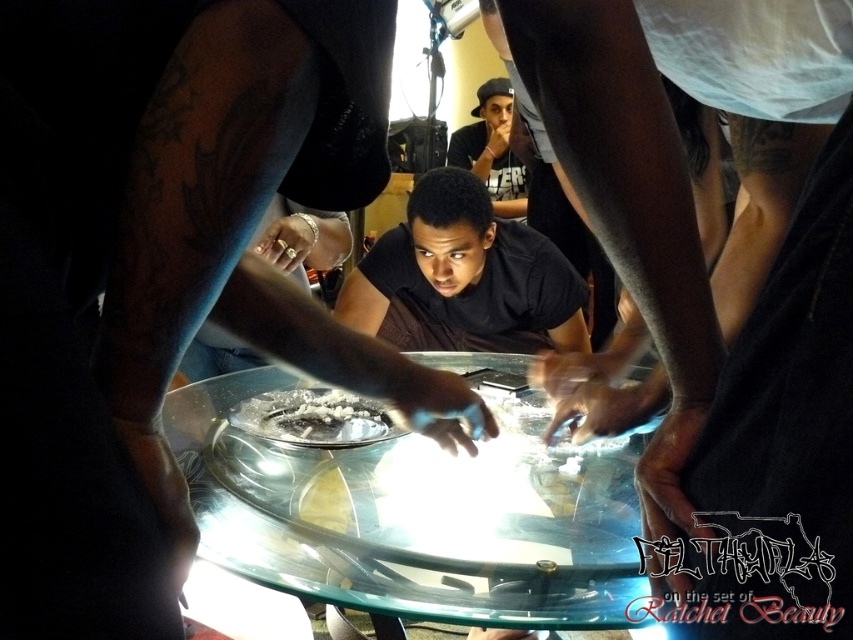
Can you confirm if white powder at center is positioned to the left of matte black shirt at upper center?

Correct, you'll find white powder at center to the left of matte black shirt at upper center.

Does white powder at center have a larger size compared to matte black shirt at upper center?

No.

Does point (334, 410) come farther from viewer compared to point (523, 173)?

No, it is not.

At what (x,y) coordinates should I click in order to perform the action: click on white powder at center. Please return your answer as a coordinate pair (x, y). The height and width of the screenshot is (640, 853). Looking at the image, I should click on (312, 417).

What do you see at coordinates (416, 515) in the screenshot? The width and height of the screenshot is (853, 640). I see `transparent glass table at center` at bounding box center [416, 515].

Is transparent glass table at center taller than black matte shirt at center?

In fact, transparent glass table at center may be shorter than black matte shirt at center.

Is point (408, 605) behind point (430, 208)?

That is False.

Identify the location of transparent glass table at center. (416, 515).

Is point (380, 512) farther from viewer compared to point (515, 214)?

No, it is not.

Between transparent glass table at center and matte black shirt at upper center, which one is positioned higher?

matte black shirt at upper center

Measure the distance between transparent glass table at center and camera.

They are 66.13 centimeters apart.

Locate an element on the screen. The image size is (853, 640). transparent glass table at center is located at coordinates (416, 515).